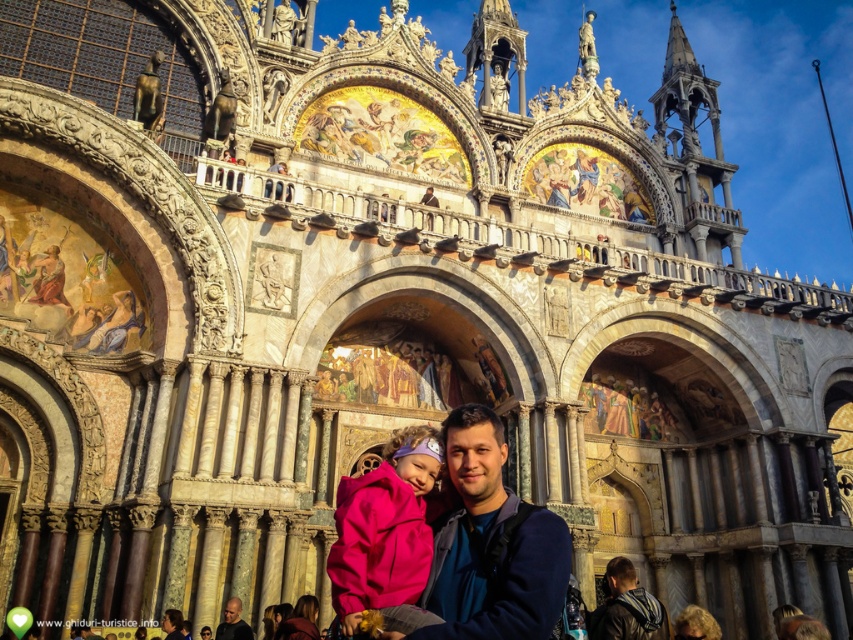
Is pink fleece jacket at center to the right of matte pink jacket at lower center from the viewer's perspective?

Correct, you'll find pink fleece jacket at center to the right of matte pink jacket at lower center.

Is point (337, 538) positioned in front of point (169, 625)?

No.

Find the location of a particular element. This screenshot has width=853, height=640. pink fleece jacket at center is located at coordinates (387, 532).

In the scene shown: Can you confirm if matte pink coat at center is positioned above blonde hair at lower right?

Indeed, matte pink coat at center is positioned over blonde hair at lower right.

Who is positioned more to the right, matte pink coat at center or blonde hair at lower right?

blonde hair at lower right

Who is more forward, (314, 605) or (698, 621)?

Positioned in front is point (698, 621).

Identify the location of matte pink coat at center. This screenshot has height=640, width=853. (300, 620).

Does point (383, 497) come in front of point (689, 609)?

That is True.

Can you confirm if pink fleece jacket at center is thinner than blonde hair at lower right?

Indeed, pink fleece jacket at center has a lesser width compared to blonde hair at lower right.

Does point (372, 602) come in front of point (689, 608)?

Yes, point (372, 602) is in front of point (689, 608).

I want to click on pink fleece jacket at center, so click(387, 532).